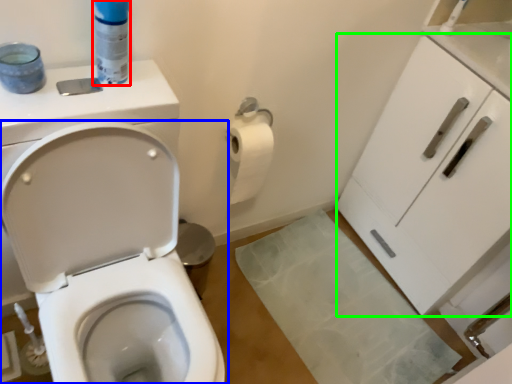
Question: Considering the real-world distances, which object is farthest from cleaning product (highlighted by a red box)? toilet (highlighted by a blue box) or cabinetry (highlighted by a green box)?

Choices:
 (A) toilet
 (B) cabinetry

Answer: (B)